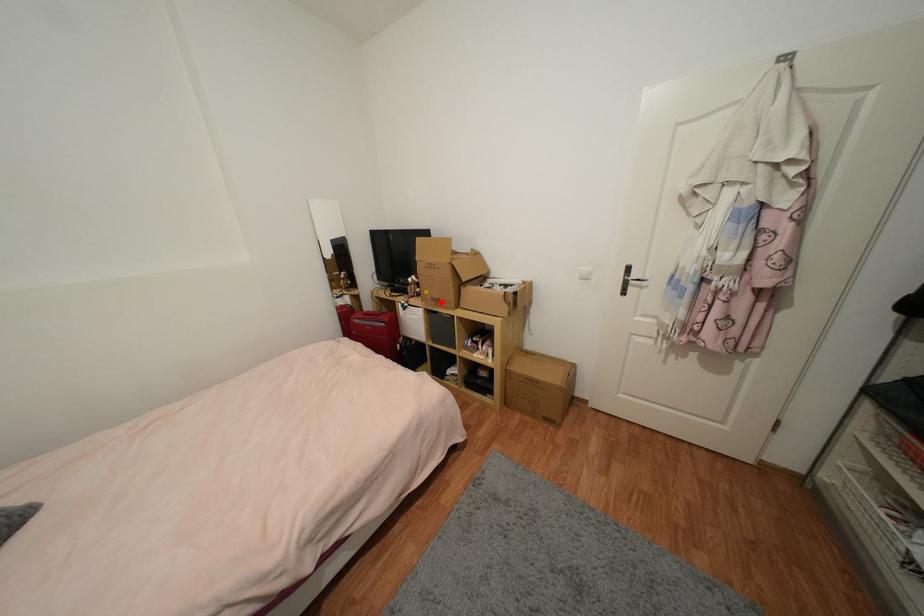
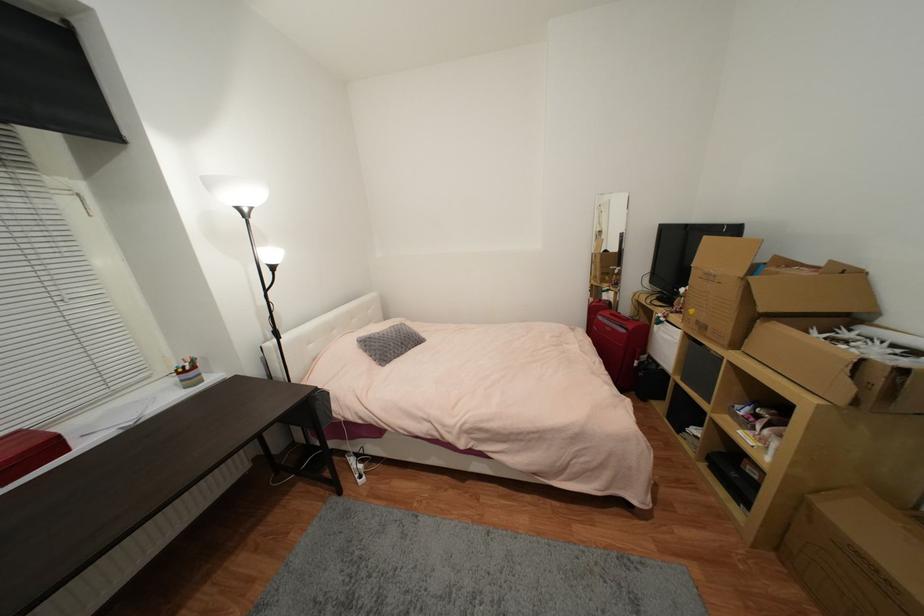
Find the pixel in the second image that matches the highlighted location in the first image.

(708, 329)